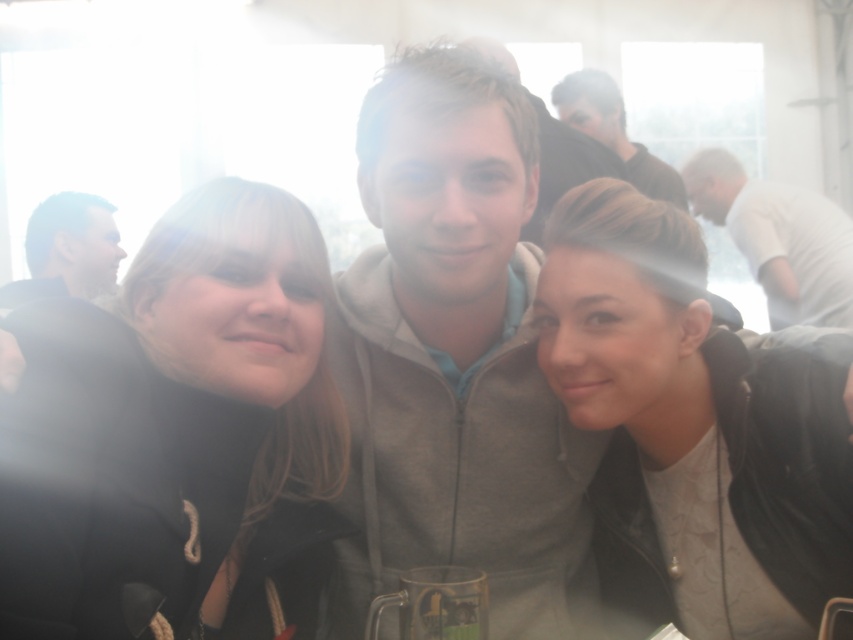
You are at a social event and want to place a small decorative item between the gray fleece jacket at center and the transparent glass mug at center. Considering their widths, which object should you place the item closer to?

The gray fleece jacket at center is wider than the transparent glass mug at center, so you should place the item closer to the transparent glass mug at center to balance the width difference.

You are standing in the room where the image was taken. You want to find the matte black jacket at left. Where should you look relative to the central figure?

The matte black jacket at left is located at point 0.392 on the x axis and 0.080 on the y axis relative to the central figure.